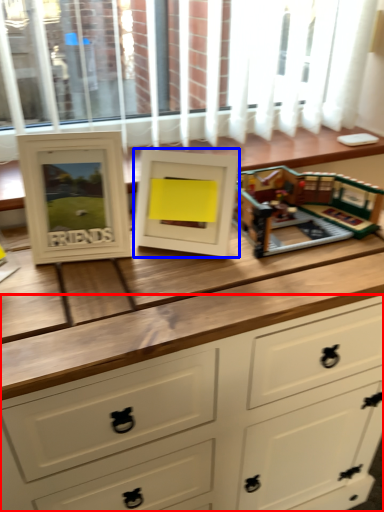
Question: Which point is closer to the camera, chest of drawers (highlighted by a red box) or picture frame (highlighted by a blue box)?

Choices:
 (A) chest of drawers
 (B) picture frame

Answer: (A)